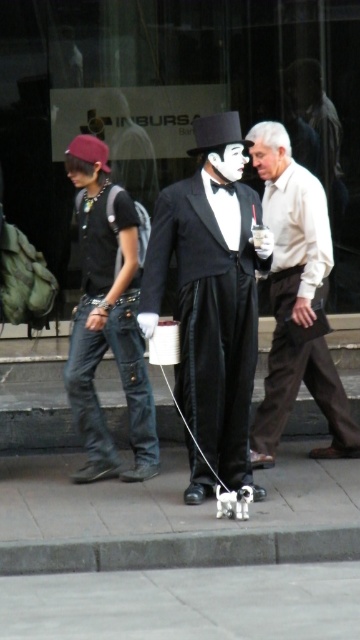
Question: Does matte black tuxedo at center have a lesser width compared to black satin bow tie at center?

Choices:
 (A) yes
 (B) no

Answer: (B)

Question: Based on their relative distances, which object is nearer to the matte white shirt at center?

Choices:
 (A) black satin bow tie at center
 (B) matte black tuxedo at center

Answer: (B)

Question: In this image, where is matte black tuxedo at center located relative to matte white shirt at center?

Choices:
 (A) right
 (B) left

Answer: (B)

Question: Can you confirm if matte black tuxedo at center is thinner than black satin bow tie at center?

Choices:
 (A) yes
 (B) no

Answer: (B)

Question: Which is nearer to the matte black tuxedo at center?

Choices:
 (A) black satin bow tie at center
 (B) matte white shirt at center

Answer: (B)

Question: Which point appears closest to the camera in this image?

Choices:
 (A) (187, 449)
 (B) (291, 401)

Answer: (A)